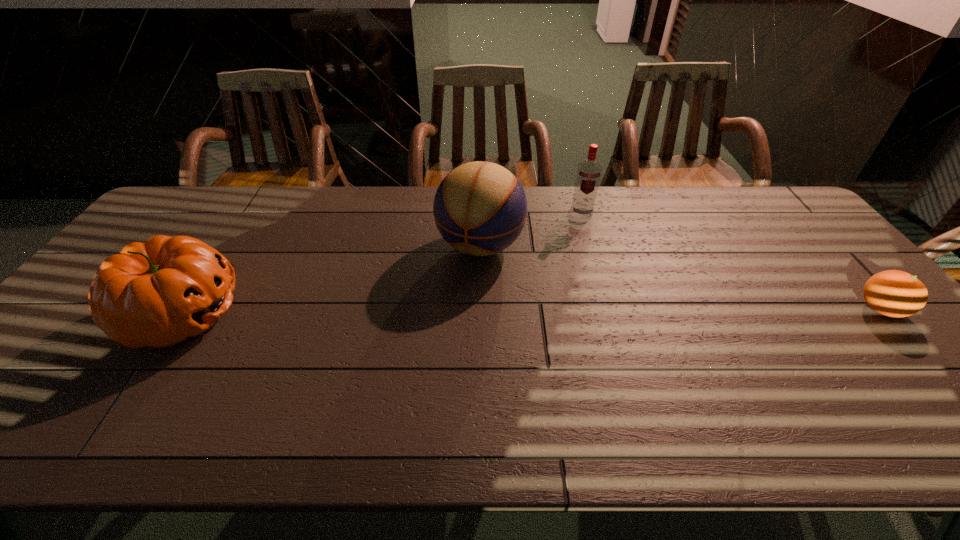
Where is `vacant space located on the front label of the second object from right to left`? The height and width of the screenshot is (540, 960). vacant space located on the front label of the second object from right to left is located at coordinates click(x=582, y=240).

This screenshot has width=960, height=540. Identify the location of vacant region located on the front label of the second object from right to left. (583, 253).

You are a GUI agent. You are given a task and a screenshot of the screen. Output one action in this format:
    pyautogui.click(x=<x>, y=<y>)
    Task: Click on the vacant space located on the patterned surface of the basketball
    
    Given the screenshot: What is the action you would take?
    pyautogui.click(x=454, y=301)

I want to click on free space located 0.180m on the patterned surface of the basketball, so click(x=445, y=320).

At what (x,y) coordinates should I click in order to perform the action: click on free space located on the patterned surface of the basketball. Please return your answer as a coordinate pair (x, y). Looking at the image, I should click on (416, 383).

The width and height of the screenshot is (960, 540). Identify the location of vodka that is at the far edge. (588, 175).

You are a GUI agent. You are given a task and a screenshot of the screen. Output one action in this format:
    pyautogui.click(x=<x>, y=<y>)
    Task: Click on the basketball at the far edge
    This screenshot has width=960, height=540.
    Given the screenshot: What is the action you would take?
    pyautogui.click(x=480, y=208)

I want to click on object positioned at the left edge, so click(158, 293).

Locate an element on the screen. The image size is (960, 540). object located in the right edge section of the desktop is located at coordinates (893, 293).

You are a GUI agent. You are given a task and a screenshot of the screen. Output one action in this format:
    pyautogui.click(x=<x>, y=<y>)
    Task: Click on the blank space at the far edge of the desktop
    
    Given the screenshot: What is the action you would take?
    pyautogui.click(x=282, y=219)